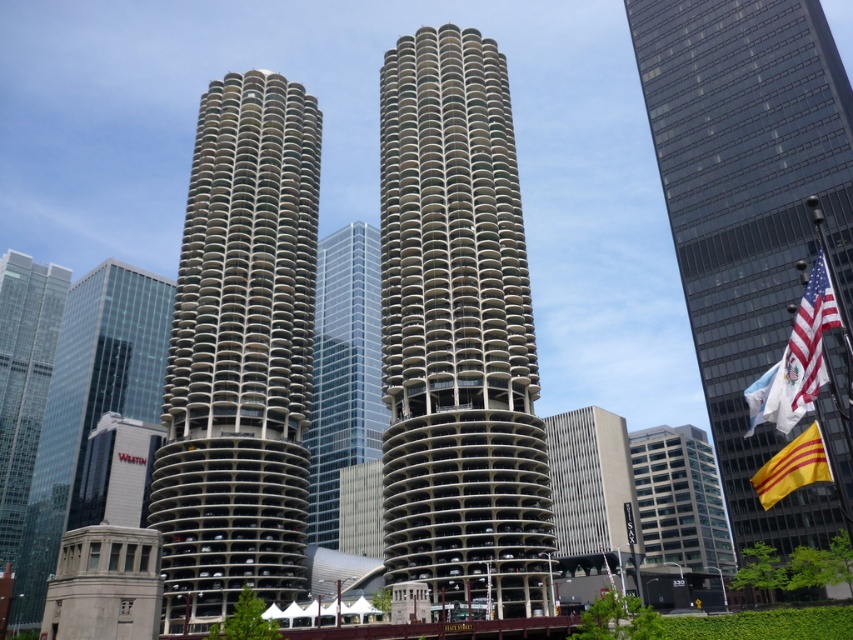
Question: Which of the following is the closest to the observer?

Choices:
 (A) (61, 292)
 (B) (318, 340)

Answer: (B)

Question: Which of the following is the farthest from the observer?

Choices:
 (A) (308, 397)
 (B) (560, 483)

Answer: (B)

Question: Is concrete textured tower at center positioned at the back of glassy reflective skyscraper at left?

Choices:
 (A) no
 (B) yes

Answer: (A)

Question: Estimate the real-world distances between objects in this image. Which object is farther from the american flag at right?

Choices:
 (A) yellowmaterial/textureflag at right
 (B) concrete textured building at center

Answer: (B)

Question: Where is concrete textured tower at center located in relation to glassy steel skyscraper at right in the image?

Choices:
 (A) above
 (B) below

Answer: (B)

Question: Can you confirm if glassy steel skyscraper at right is bigger than glassy reflective skyscraper at left?

Choices:
 (A) no
 (B) yes

Answer: (B)